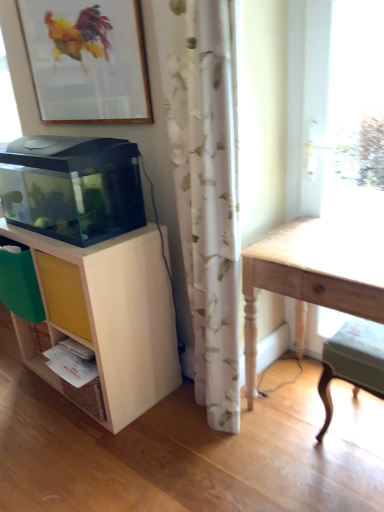
You are a GUI agent. You are given a task and a screenshot of the screen. Output one action in this format:
    pyautogui.click(x=<x>, y=<y>)
    Task: Click on the vacant area that lies in front of white floral curtain at center
    The height and width of the screenshot is (512, 384).
    Given the screenshot: What is the action you would take?
    pyautogui.click(x=218, y=459)